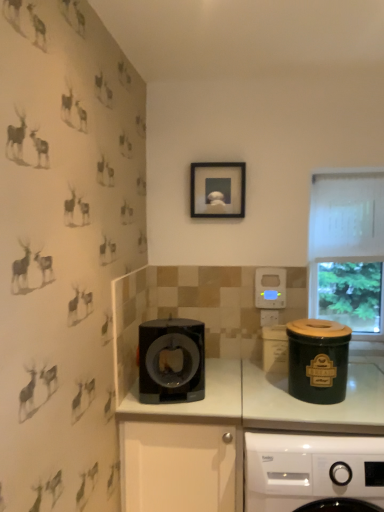
Where is `vacant area on top of black plastic drawer at center (from a real-world perspective)`? The width and height of the screenshot is (384, 512). vacant area on top of black plastic drawer at center (from a real-world perspective) is located at coordinates (205, 389).